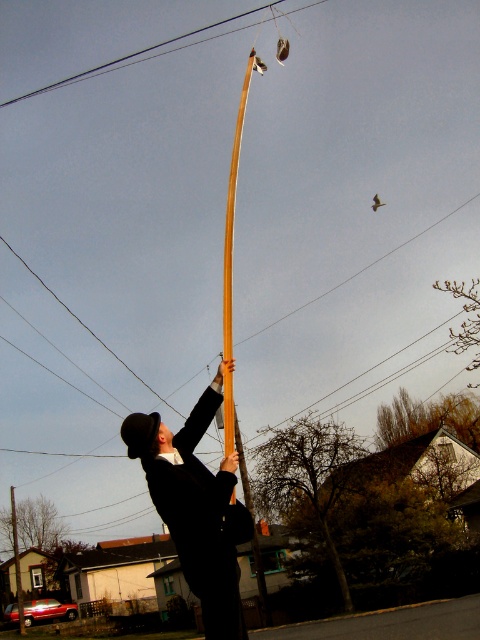
Looking at this image, does matte black coat at center have a greater width compared to metallic wire at upper center?

No.

Is matte black coat at center shorter than metallic wire at upper center?

Indeed, matte black coat at center has a lesser height compared to metallic wire at upper center.

What do you see at coordinates (196, 508) in the screenshot?
I see `matte black coat at center` at bounding box center [196, 508].

Find the location of a particular element. matte black coat at center is located at coordinates (196, 508).

Can you confirm if matte black coat at center is wider than wooden pole at upper center?

No.

Is matte black coat at center to the left of wooden pole at upper center from the viewer's perspective?

No, matte black coat at center is not to the left of wooden pole at upper center.

Is point (200, 506) positioned in front of point (230, 314)?

Yes.

Identify the location of matte black coat at center. (196, 508).

Does wooden pole at upper center have a greater height compared to metallic wire at upper center?

Yes, wooden pole at upper center is taller than metallic wire at upper center.

Does point (226, 449) lie in front of point (69, 83)?

Yes, it is in front of point (69, 83).

The width and height of the screenshot is (480, 640). What are the coordinates of `wooden pole at upper center` in the screenshot? It's located at (233, 209).